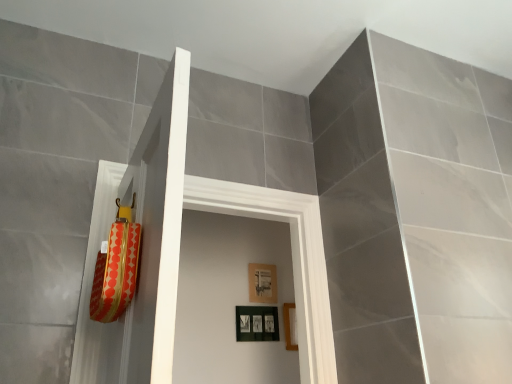
What do you see at coordinates (290, 326) in the screenshot? This screenshot has width=512, height=384. I see `wooden picture frame at center` at bounding box center [290, 326].

The image size is (512, 384). Find the location of `wooden picture frame at center`. wooden picture frame at center is located at coordinates (290, 326).

In order to click on wooden picture frame at center in this screenshot , I will do `click(290, 326)`.